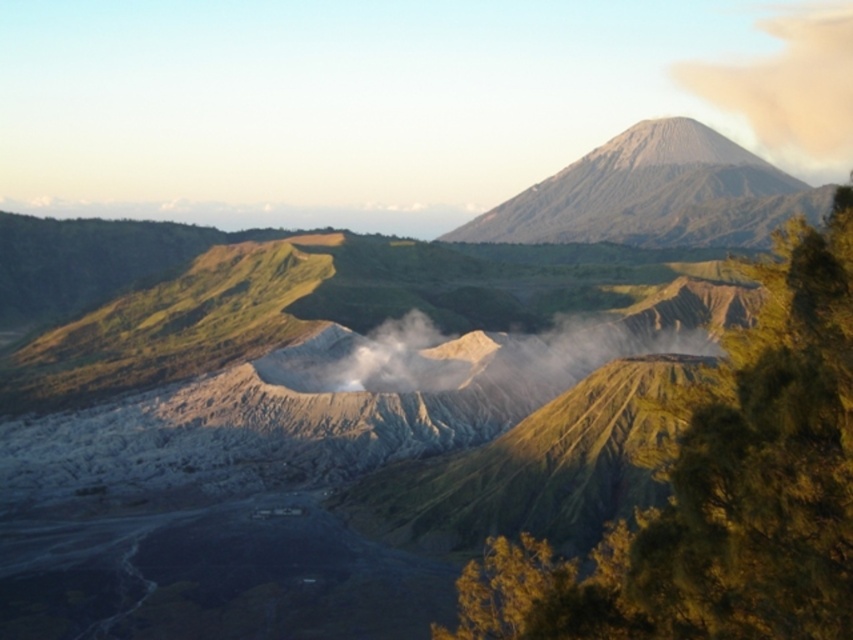
Does gray/smooth mountain at upper right lie behind white dusty cloud at upper right?

That is False.

Does gray/smooth mountain at upper right come in front of white dusty cloud at upper right?

Yes, gray/smooth mountain at upper right is closer to the viewer.

Is point (728, 154) positioned in front of point (730, 96)?

Yes, point (728, 154) is in front of point (730, 96).

Where is `gray/smooth mountain at upper right`? Image resolution: width=853 pixels, height=640 pixels. gray/smooth mountain at upper right is located at coordinates point(654,195).

Which is in front, point (531, 390) or point (756, 102)?

Point (531, 390)

The width and height of the screenshot is (853, 640). What do you see at coordinates (479, 356) in the screenshot?
I see `white smoke at center` at bounding box center [479, 356].

Where is `white smoke at center`? This screenshot has height=640, width=853. white smoke at center is located at coordinates (479, 356).

Is point (497, 216) positioned behind point (519, 378)?

Yes, point (497, 216) is behind point (519, 378).

Which is above, gray/smooth mountain at upper right or white smoke at center?

gray/smooth mountain at upper right

At what (x,y) coordinates should I click in order to perform the action: click on gray/smooth mountain at upper right. Please return your answer as a coordinate pair (x, y). Looking at the image, I should click on (654, 195).

At what (x,y) coordinates should I click in order to perform the action: click on gray/smooth mountain at upper right. Please return your answer as a coordinate pair (x, y). This screenshot has width=853, height=640. Looking at the image, I should click on (654, 195).